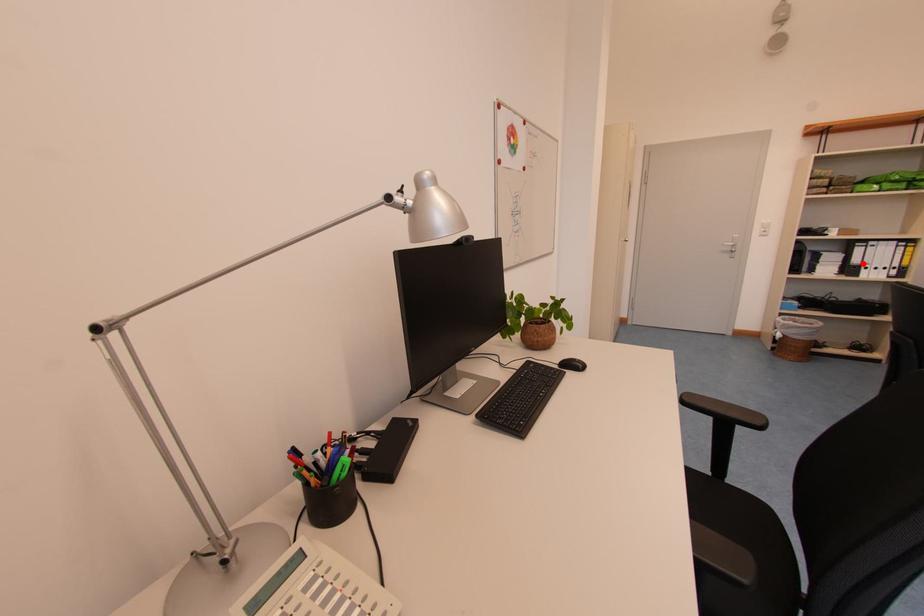
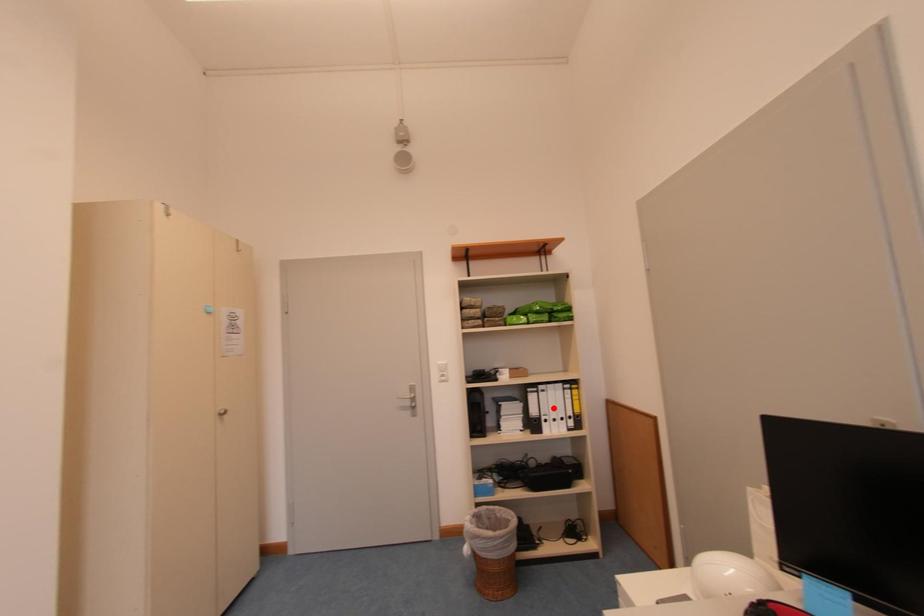
I am providing you with two images of the same scene from different viewpoints. A red point is marked on the first image and another point is marked on the second image. Does the point marked in image1 correspond to the same location as the one in image2?

No